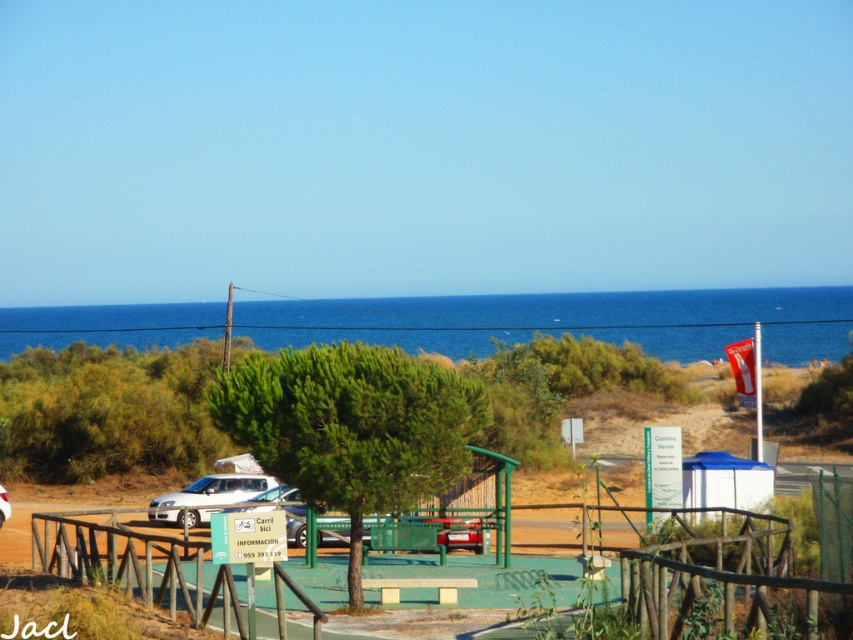
Does green metal bench at center have a greater height compared to white matte car at center?

Correct, green metal bench at center is much taller as white matte car at center.

Who is taller, green metal bench at center or white matte car at center?

green metal bench at center

What do you see at coordinates (216, 416) in the screenshot? The image size is (853, 640). I see `green metal bench at center` at bounding box center [216, 416].

Locate an element on the screen. The width and height of the screenshot is (853, 640). green metal bench at center is located at coordinates (216, 416).

Between point (241, 474) and point (0, 483), which one is positioned in front?

Point (241, 474)

Between point (225, 476) and point (6, 490), which one is positioned in front?

Point (225, 476) is in front.

Where is `white matte car at lower left`? This screenshot has width=853, height=640. white matte car at lower left is located at coordinates (207, 493).

Who is shorter, green metal bench at center or white matte car at lower left?

With less height is white matte car at lower left.

Does green metal bench at center appear on the left side of white matte car at lower left?

Incorrect, green metal bench at center is not on the left side of white matte car at lower left.

Does point (619, 369) come in front of point (187, 516)?

No, it is not.

Find the location of a particular element. This screenshot has width=853, height=640. green metal bench at center is located at coordinates coord(216,416).